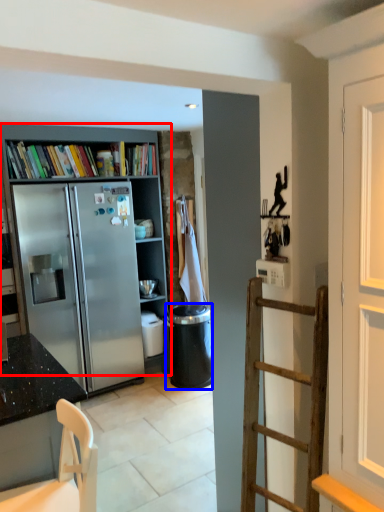
Question: Which object appears closest to the camera in this image, bookcase (highlighted by a red box) or trash bin/can (highlighted by a blue box)?

Choices:
 (A) bookcase
 (B) trash bin/can

Answer: (A)